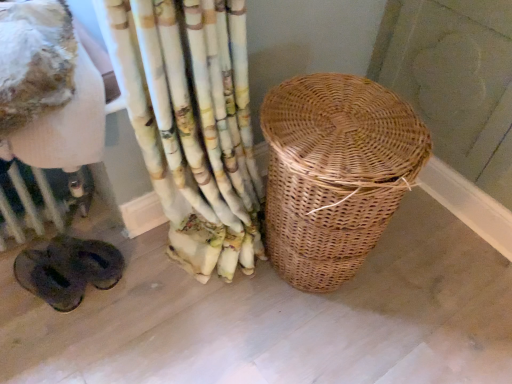
Describe the element at coordinates (335, 173) in the screenshot. I see `woven brown basket at center` at that location.

Locate an element on the screen. The width and height of the screenshot is (512, 384). woven brown basket at center is located at coordinates (335, 173).

Find the location of a particular element. The height and width of the screenshot is (384, 512). white painted radiator at lower left is located at coordinates (33, 202).

In order to face white painted radiator at lower left, should I rotate leftwards or rightwards?

A 28.163 degree turn to the left will do.

Describe the element at coordinates (33, 202) in the screenshot. The image size is (512, 384). I see `white painted radiator at lower left` at that location.

The width and height of the screenshot is (512, 384). I want to click on woven brown basket at center, so click(x=335, y=173).

Which is more to the left, white painted radiator at lower left or woven brown basket at center?

white painted radiator at lower left is more to the left.

Which object is closer to the camera taking this photo, white painted radiator at lower left or woven brown basket at center?

woven brown basket at center.

Is point (0, 232) farther from camera compared to point (317, 129)?

Yes, it is.

From the image's perspective, does white painted radiator at lower left appear lower than woven brown basket at center?

Indeed, from the image's perspective, white painted radiator at lower left is shown beneath woven brown basket at center.

From a real-world perspective, which is physically above, white painted radiator at lower left or woven brown basket at center?

From a 3D spatial view, woven brown basket at center is above.

Is white painted radiator at lower left thinner than woven brown basket at center?

Yes.

Who is taller, white painted radiator at lower left or woven brown basket at center?

Standing taller between the two is woven brown basket at center.

Consider the image. In terms of size, does white painted radiator at lower left appear bigger or smaller than woven brown basket at center?

In the image, white painted radiator at lower left appears to be smaller than woven brown basket at center.

Is white painted radiator at lower left not within woven brown basket at center?

Yes, white painted radiator at lower left is located beyond the bounds of woven brown basket at center.

Is white painted radiator at lower left with woven brown basket at center?

There is a gap between white painted radiator at lower left and woven brown basket at center.

Does white painted radiator at lower left turn towards woven brown basket at center?

No, white painted radiator at lower left is not oriented towards woven brown basket at center.

Locate an element on the screen. picnic basket above the white painted radiator at lower left (from a real-world perspective) is located at coordinates (335, 173).

Considering the relative positions of woven brown basket at center and white painted radiator at lower left in the image provided, is woven brown basket at center to the right of white painted radiator at lower left from the viewer's perspective?

Indeed, woven brown basket at center is positioned on the right side of white painted radiator at lower left.

Is woven brown basket at center behind white painted radiator at lower left?

No, woven brown basket at center is closer to the viewer.

Considering the positions of point (288, 212) and point (24, 219), is point (288, 212) closer or farther from the camera than point (24, 219)?

Point (288, 212) is closer to the camera than point (24, 219).

From the image's perspective, is woven brown basket at center above or below white painted radiator at lower left?

From the image's perspective, woven brown basket at center appears above white painted radiator at lower left.

From a real-world perspective, relative to white painted radiator at lower left, is woven brown basket at center vertically above or below?

In terms of real-world spatial position, woven brown basket at center is above white painted radiator at lower left.

Considering the relative sizes of woven brown basket at center and white painted radiator at lower left in the image provided, is woven brown basket at center thinner than white painted radiator at lower left?

No, woven brown basket at center is not thinner than white painted radiator at lower left.

Is woven brown basket at center taller than white painted radiator at lower left?

Indeed, woven brown basket at center has a greater height compared to white painted radiator at lower left.

Does woven brown basket at center have a smaller size compared to white painted radiator at lower left?

No.

Is woven brown basket at center positioned beyond the bounds of white painted radiator at lower left?

Indeed, woven brown basket at center is completely outside white painted radiator at lower left.

Is woven brown basket at center beside white painted radiator at lower left?

No, woven brown basket at center is not touching white painted radiator at lower left.

In the scene shown: Is woven brown basket at center turned away from white painted radiator at lower left?

woven brown basket at center is not turned away from white painted radiator at lower left.

Locate an element on the screen. This screenshot has width=512, height=384. picnic basket lying on the right of white painted radiator at lower left is located at coordinates (335, 173).

At what (x,y) coordinates should I click in order to perform the action: click on picnic basket above the white painted radiator at lower left (from the image's perspective). Please return your answer as a coordinate pair (x, y). Looking at the image, I should click on (335, 173).

The image size is (512, 384). Identify the location of radiator located below the woven brown basket at center (from the image's perspective). (33, 202).